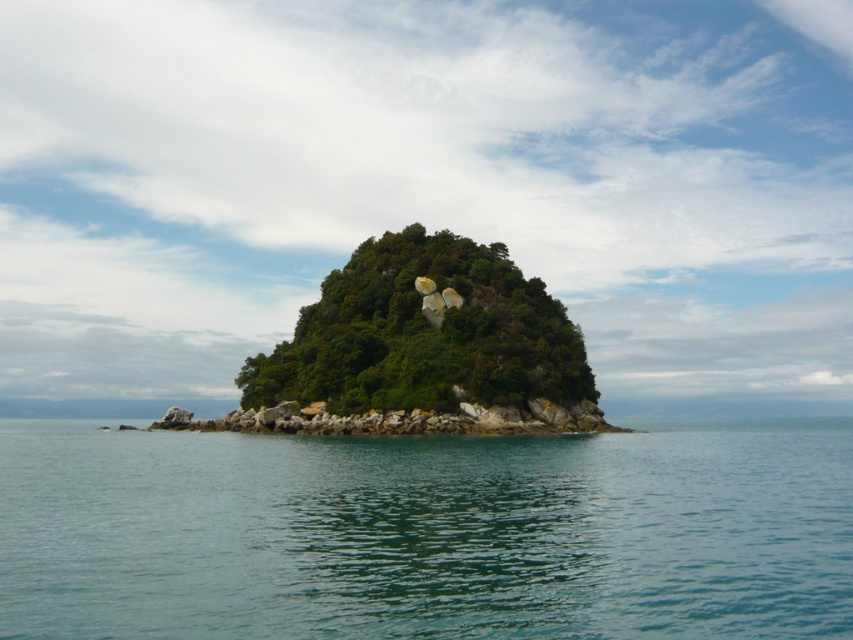
Question: Does clear blue water at center come behind green leafy island at center?

Choices:
 (A) no
 (B) yes

Answer: (A)

Question: Which point is closer to the camera?

Choices:
 (A) green leafy island at center
 (B) clear blue water at center

Answer: (B)

Question: Which of the following is the farthest from the observer?

Choices:
 (A) green leafy island at center
 (B) clear blue water at center

Answer: (A)

Question: Among these objects, which one is nearest to the camera?

Choices:
 (A) green leafy island at center
 (B) clear blue water at center

Answer: (B)

Question: Does clear blue water at center appear over green leafy island at center?

Choices:
 (A) no
 (B) yes

Answer: (A)

Question: Does clear blue water at center appear under green leafy island at center?

Choices:
 (A) yes
 (B) no

Answer: (A)